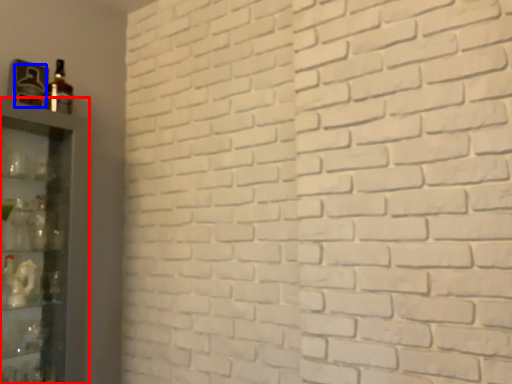
Question: Which of the following is the farthest to the observer, shelf (highlighted by a red box) or bottle (highlighted by a blue box)?

Choices:
 (A) shelf
 (B) bottle

Answer: (B)